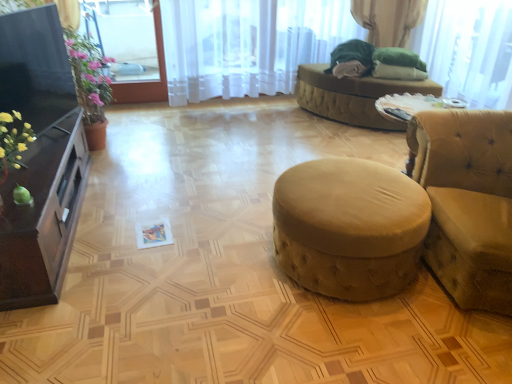
Question: From a real-world perspective, is suede-like beige stool at center positioned above or below matte black cabinet at left?

Choices:
 (A) below
 (B) above

Answer: (B)

Question: Based on their sizes in the image, would you say suede-like beige stool at center is bigger or smaller than matte black cabinet at left?

Choices:
 (A) small
 (B) big

Answer: (A)

Question: Which object is the closest to the velvet beige ottoman at center?

Choices:
 (A) velvet yellow studio couch at right
 (B) clear glass window at upper left, the first window screen in the left-to-right sequence
 (C) white sheer curtain at upper center
 (D) beige fabric ottoman at center
 (E) matte black cabinet at left

Answer: (A)

Question: Estimate the real-world distances between objects in this image. Which object is closer to the white sheer curtain at upper center?

Choices:
 (A) matte black cabinet at left
 (B) velvet beige ottoman at center
 (C) green fabric at upper right
 (D) velvet yellow studio couch at right
 (E) beige fabric ottoman at center

Answer: (E)